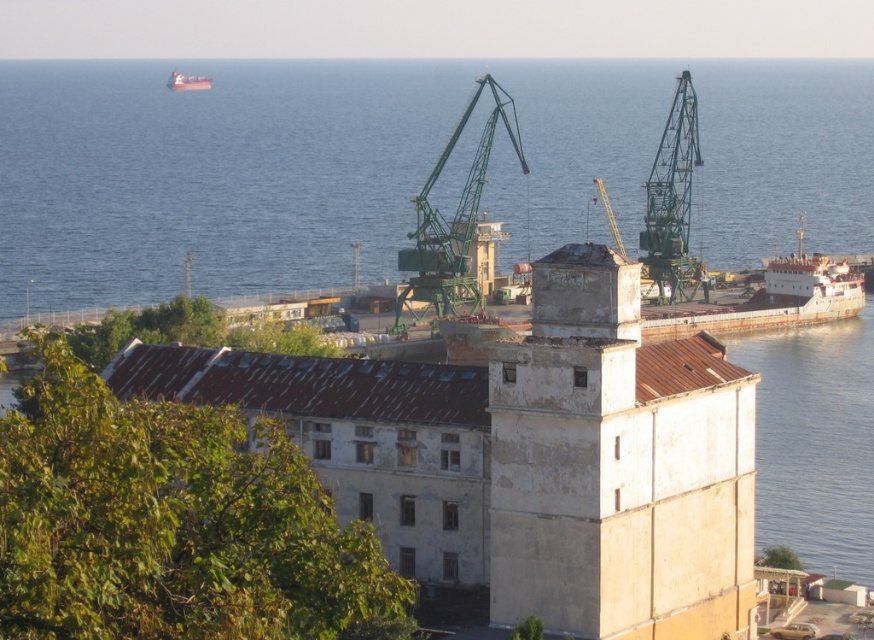
Consider the image. Can you confirm if white concrete tower at center is bigger than white matte boat at upper left?

Yes.

Is white concrete tower at center to the left of white matte boat at upper left from the viewer's perspective?

In fact, white concrete tower at center is to the right of white matte boat at upper left.

Does point (656, 460) come in front of point (168, 83)?

Yes.

Where is `white concrete tower at center`? white concrete tower at center is located at coordinates (616, 467).

Does white concrete tower at center have a larger size compared to green metallic crane at center?

No, white concrete tower at center is not bigger than green metallic crane at center.

Is point (585, 248) closer to camera compared to point (442, 166)?

Yes.

Image resolution: width=874 pixels, height=640 pixels. What are the coordinates of `white concrete tower at center` in the screenshot? It's located at (616, 467).

Who is higher up, white concrete tower at center or green metallic crane at upper right?

Positioned higher is green metallic crane at upper right.

Does white concrete tower at center appear on the right side of green metallic crane at upper right?

In fact, white concrete tower at center is to the left of green metallic crane at upper right.

At what (x,y) coordinates should I click in order to perform the action: click on white concrete tower at center. Please return your answer as a coordinate pair (x, y). This screenshot has height=640, width=874. Looking at the image, I should click on (616, 467).